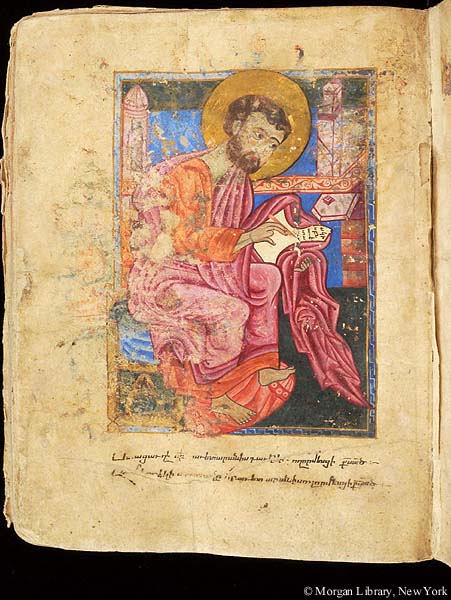
This screenshot has width=451, height=600. Identify the location of book. (85, 235).